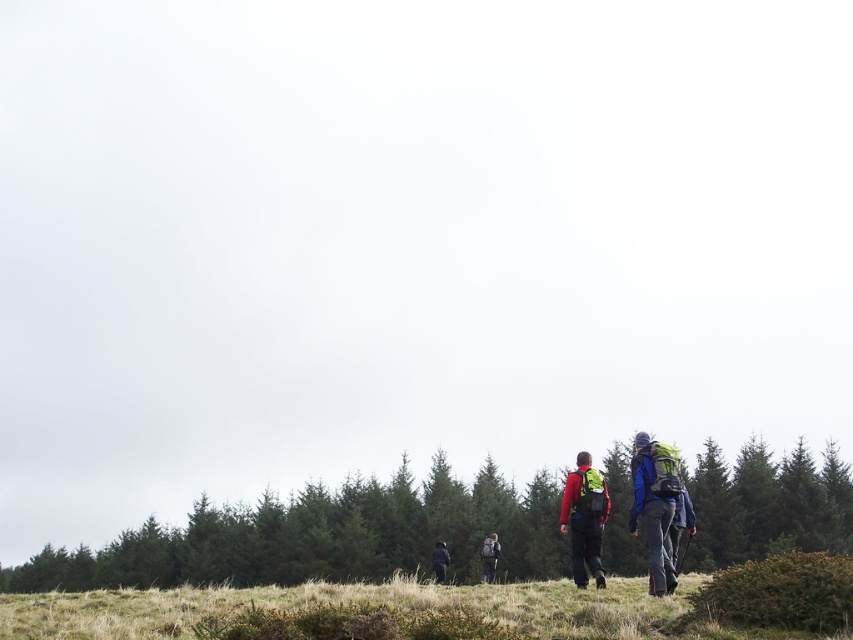
Who is taller, grassy field at lower center or green fabric backpack at center?

green fabric backpack at center is taller.

The height and width of the screenshot is (640, 853). Identify the location of grassy field at lower center. (375, 608).

Does grassy field at lower center appear under matte red jacket at center?

Yes, grassy field at lower center is below matte red jacket at center.

Does point (7, 612) come in front of point (587, 477)?

Yes.

Between point (36, 624) and point (582, 486), which one is positioned behind?

The point (582, 486) is more distant.

This screenshot has height=640, width=853. I want to click on grassy field at lower center, so click(375, 608).

Between matte red jacket at center and dark green jacket at center, which one has less height?

matte red jacket at center

Does matte red jacket at center appear under dark green jacket at center?

Actually, matte red jacket at center is above dark green jacket at center.

Which is in front, point (572, 472) or point (430, 564)?

Point (572, 472) is in front.

You are a GUI agent. You are given a task and a screenshot of the screen. Output one action in this format:
    pyautogui.click(x=<x>, y=<y>)
    Task: Click on the matte red jacket at center
    The image size is (853, 640).
    Given the screenshot: What is the action you would take?
    pyautogui.click(x=584, y=518)